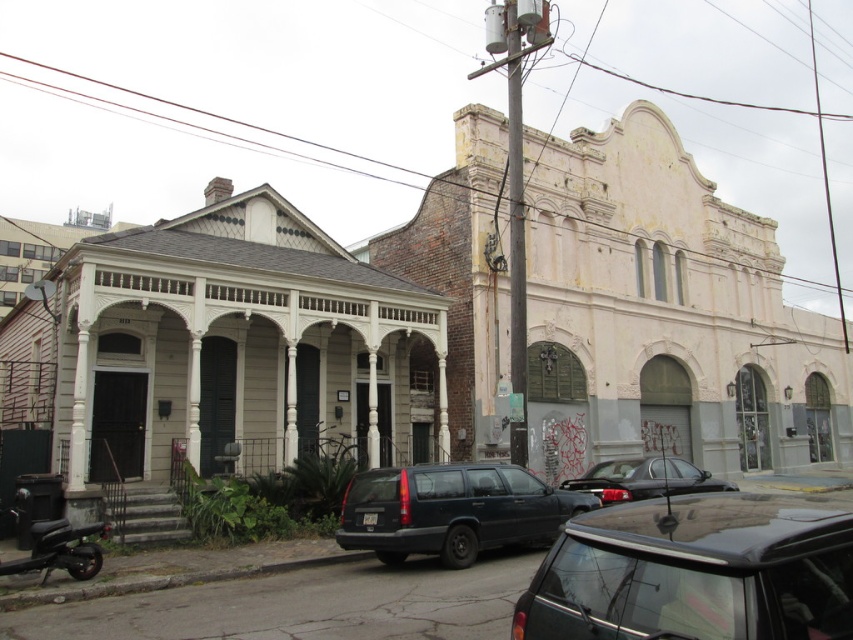
Question: Among these objects, which one is farthest from the camera?

Choices:
 (A) shiny black scooter at lower left
 (B) matte dark blue station wagon at center

Answer: (B)

Question: Which object is the closest to the shiny black scooter at lower left?

Choices:
 (A) glossy black sedan at center
 (B) shiny black suv at center
 (C) matte dark blue station wagon at center

Answer: (C)

Question: Is matte dark blue station wagon at center to the right of shiny black scooter at lower left from the viewer's perspective?

Choices:
 (A) no
 (B) yes

Answer: (B)

Question: Is matte dark blue station wagon at center bigger than shiny black scooter at lower left?

Choices:
 (A) no
 (B) yes

Answer: (B)

Question: Estimate the real-world distances between objects in this image. Which object is closer to the glossy black sedan at center?

Choices:
 (A) shiny black scooter at lower left
 (B) matte dark blue station wagon at center
 (C) shiny black suv at center

Answer: (B)

Question: Can you confirm if shiny black suv at center is bigger than shiny black scooter at lower left?

Choices:
 (A) yes
 (B) no

Answer: (A)